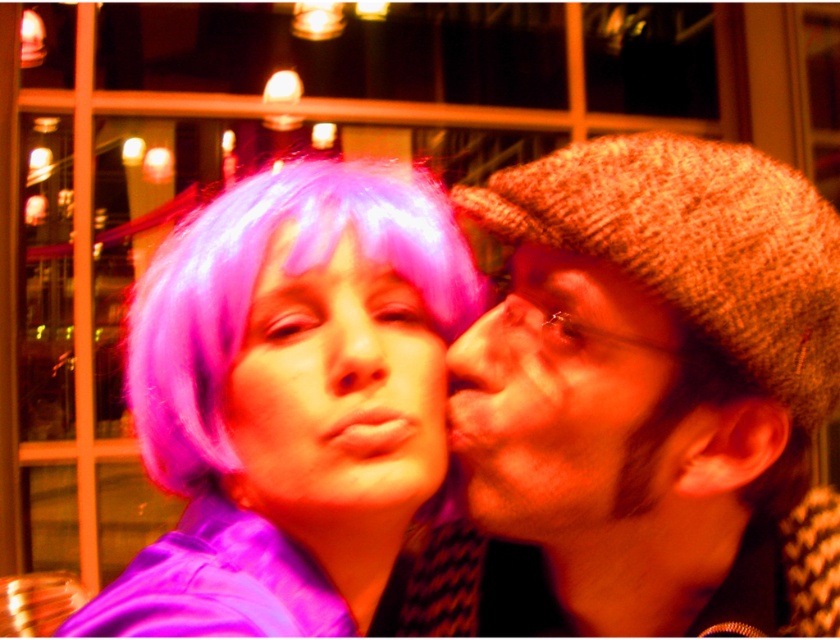
Can you confirm if purple wig at center is wider than purple matte wig at center?

Correct, the width of purple wig at center exceeds that of purple matte wig at center.

Does point (437, 404) come behind point (329, 227)?

Yes, point (437, 404) is farther from viewer.

Where is `purple wig at center`? This screenshot has height=640, width=840. purple wig at center is located at coordinates (336, 392).

Does purple wig at center lie in front of matte pink nose at center?

No, purple wig at center is behind matte pink nose at center.

Does purple wig at center have a greater height compared to matte pink nose at center?

Correct, purple wig at center is much taller as matte pink nose at center.

Who is more distant from viewer, (412, 476) or (365, 396)?

Positioned behind is point (412, 476).

Locate an element on the screen. purple wig at center is located at coordinates (336, 392).

Does knitted wool cap at upper right come behind purple synthetic wig at upper left?

Yes, knitted wool cap at upper right is behind purple synthetic wig at upper left.

Does point (665, 592) lie behind point (142, 328)?

Yes, point (665, 592) is farther from viewer.

Locate an element on the screen. knitted wool cap at upper right is located at coordinates (651, 368).